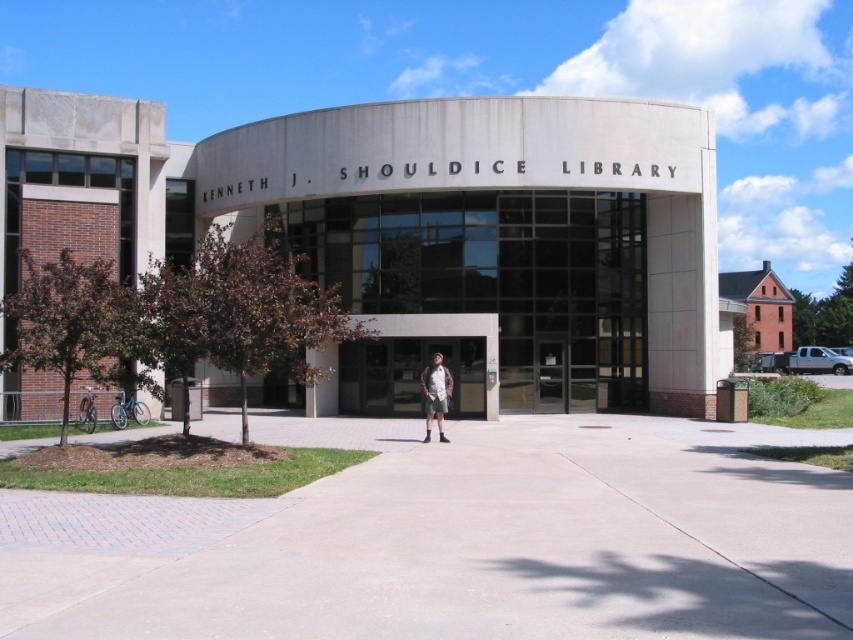
You are standing in front of the Kenneth J. Shouldice Library and notice two items at the center of the scene. Which one is bigger, the concrete at center or the khaki shorts at center?

The concrete at center has a larger size compared to khaki shorts at center, so the concrete at center is bigger.

You are standing in front of the Kenneth J. Shouldice Library and notice the concrete at center and khaki shorts at center. Which object is taller?

The khaki shorts at center are taller than the concrete at center.

You are standing at the entrance of the Kenneth J. Shouldice Library and want to walk to the concrete at center. What direction should you go?

The concrete at center is located at point (457, 540), so you should walk forward from the entrance towards the center of the library area to reach it.